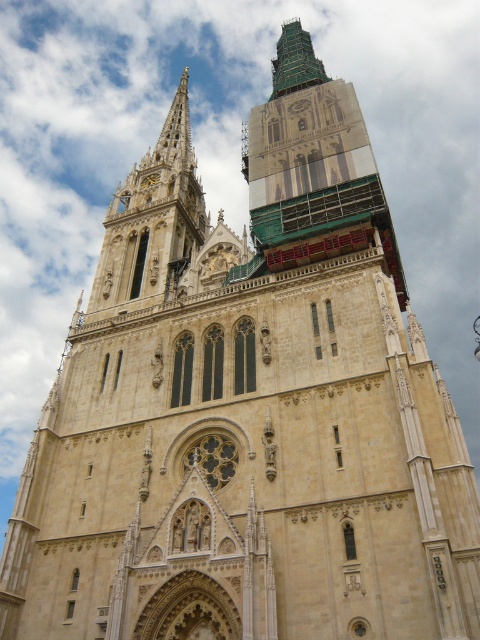
Between green glass tower at upper center and beige stone spire at upper left, which one has more height?

With more height is green glass tower at upper center.

At what (x,y) coordinates should I click in order to perform the action: click on green glass tower at upper center. Please return your answer as a coordinate pair (x, y). The width and height of the screenshot is (480, 640). Looking at the image, I should click on (312, 164).